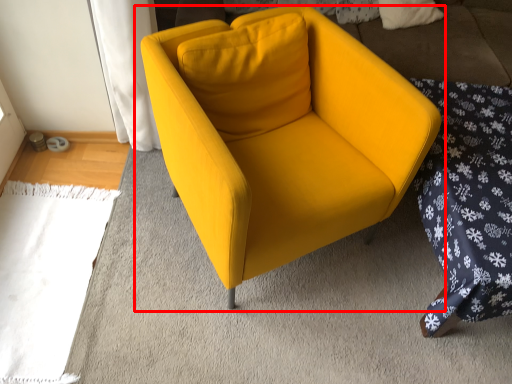
Question: From the image's perspective, what is the correct spatial relationship of chair (annotated by the red box) in relation to bedding?

Choices:
 (A) above
 (B) below

Answer: (A)